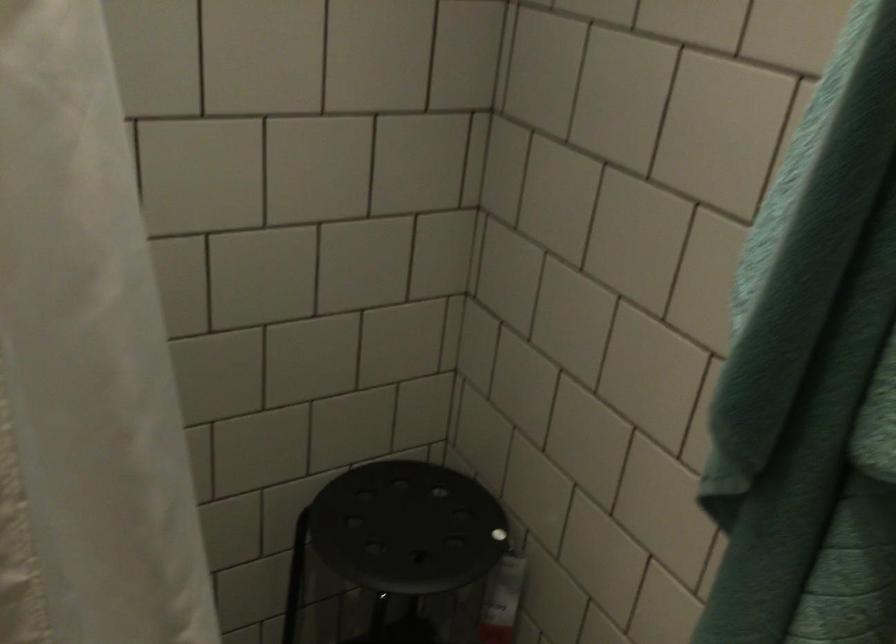
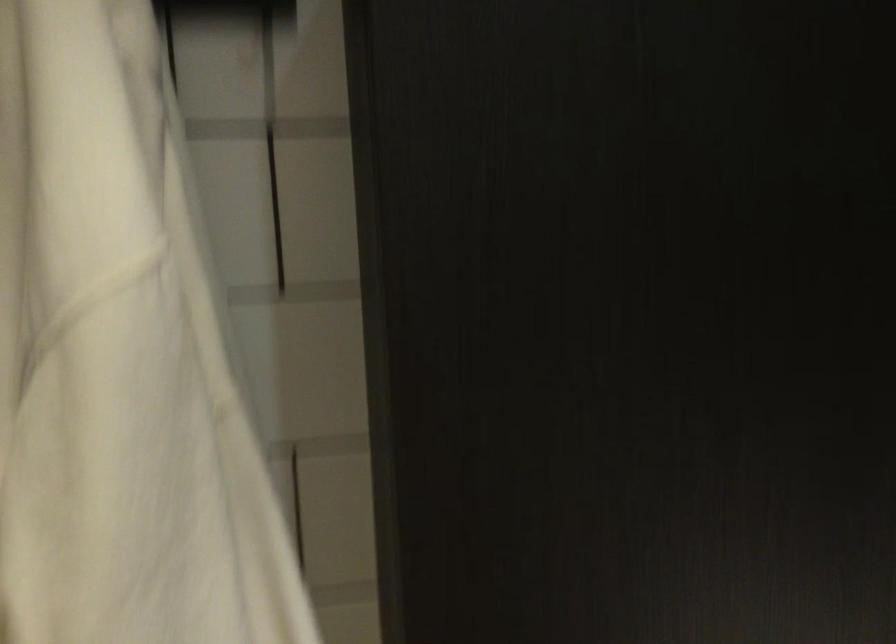
Question: How did the camera likely rotate?

Choices:
 (A) Left
 (B) Right
 (C) Up
 (D) Down

Answer: (A)